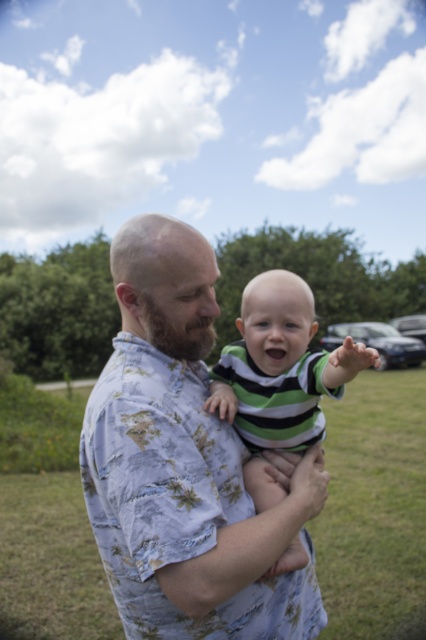
Question: Can you confirm if floral cotton shirt at center is wider than green striped shirt at center?

Choices:
 (A) yes
 (B) no

Answer: (A)

Question: Can you confirm if floral cotton shirt at center is positioned below green striped shirt at center?

Choices:
 (A) yes
 (B) no

Answer: (A)

Question: Which point appears farthest from the camera in this image?

Choices:
 (A) (123, 310)
 (B) (290, 442)

Answer: (B)

Question: Is floral cotton shirt at center further to the viewer compared to green striped shirt at center?

Choices:
 (A) yes
 (B) no

Answer: (B)